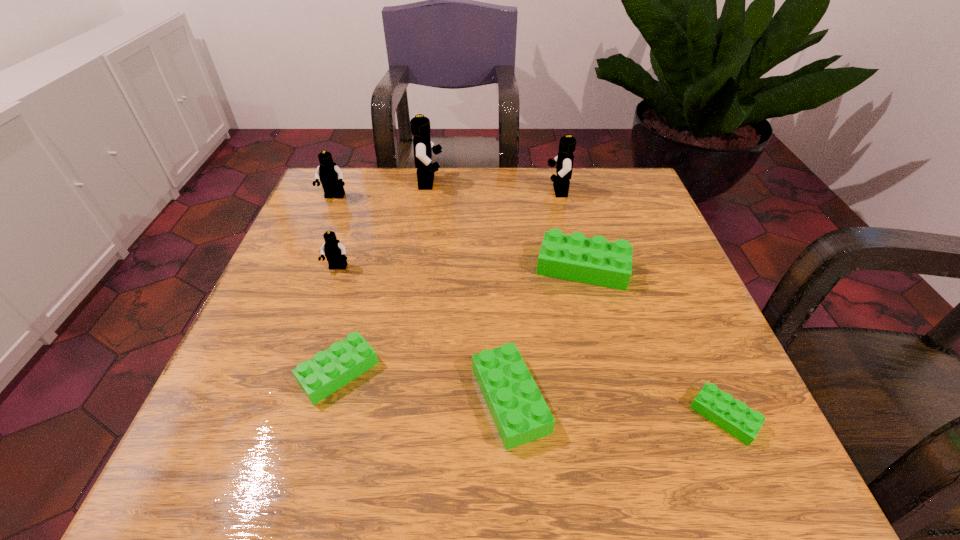
The width and height of the screenshot is (960, 540). I want to click on free spot that satisfies the following two spatial constraints: 1. on the front-facing side of the fourth object from left to right; 2. on the right side of the shortest Lego, so click(395, 416).

You are a GUI agent. You are given a task and a screenshot of the screen. Output one action in this format:
    pyautogui.click(x=<x>, y=<y>)
    Task: Click on the free location that satisfies the following two spatial constraints: 1. on the back side of the biggest green Lego; 2. on the left side of the third green Lego from right to left
    
    Given the screenshot: What is the action you would take?
    pyautogui.click(x=503, y=268)

What are the coordinates of `free location that satisfies the following two spatial constraints: 1. on the front-facing side of the rightmost object; 2. on the right side of the second biggest black Lego` in the screenshot? It's located at (609, 416).

Where is `vacant space that satisfies the following two spatial constraints: 1. on the front side of the third green Lego from left to right; 2. on the right side of the smallest green Lego`? vacant space that satisfies the following two spatial constraints: 1. on the front side of the third green Lego from left to right; 2. on the right side of the smallest green Lego is located at coordinates (619, 416).

Locate an element on the screen. This screenshot has height=540, width=960. free spot that satisfies the following two spatial constraints: 1. on the front-facing side of the leftmost black Lego; 2. on the left side of the second green Lego from left to right is located at coordinates (250, 399).

Where is `vacant position in the image that satisfies the following two spatial constraints: 1. on the front-facing side of the seventh shortest object; 2. on the front-facing side of the third biggest black Lego`? vacant position in the image that satisfies the following two spatial constraints: 1. on the front-facing side of the seventh shortest object; 2. on the front-facing side of the third biggest black Lego is located at coordinates (559, 197).

You are a GUI agent. You are given a task and a screenshot of the screen. Output one action in this format:
    pyautogui.click(x=<x>, y=<y>)
    Task: Click on the vacant space that satisfies the following two spatial constraints: 1. on the back side of the rightmost Lego; 2. on the front-facing side of the third black Lego from left to right
    This screenshot has height=540, width=960.
    Given the screenshot: What is the action you would take?
    pyautogui.click(x=623, y=183)

Locate an element on the screen. vacant space that satisfies the following two spatial constraints: 1. on the front-facing side of the tallest Lego; 2. on the front-facing side of the sixth shortest object is located at coordinates (427, 197).

In order to click on free space that satisfies the following two spatial constraints: 1. on the front-facing side of the second black Lego from right to left; 2. on the front-facing side of the third tallest object in this screenshot , I will do `click(427, 197)`.

Where is `free space that satisfies the following two spatial constraints: 1. on the front-facing side of the smallest green Lego; 2. on the left side of the third smallest black Lego`? This screenshot has width=960, height=540. free space that satisfies the following two spatial constraints: 1. on the front-facing side of the smallest green Lego; 2. on the left side of the third smallest black Lego is located at coordinates (609, 416).